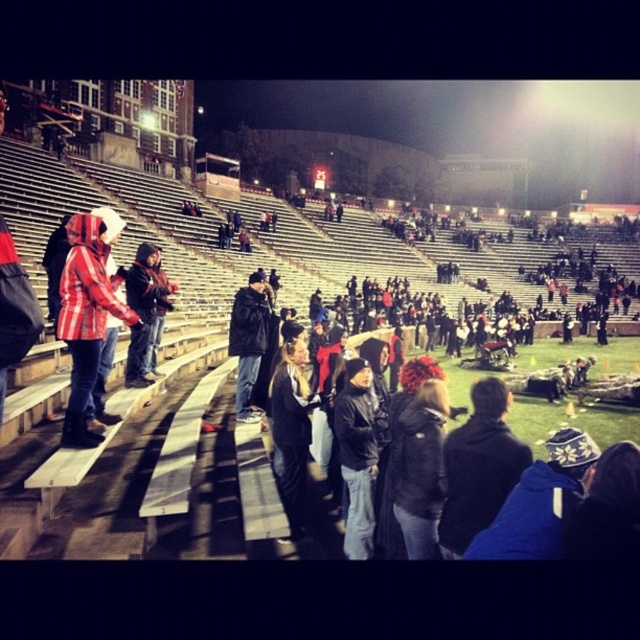
Can you confirm if dark gray leather jacket at center is taller than black leather jacket at center?

In fact, dark gray leather jacket at center may be shorter than black leather jacket at center.

Is point (358, 368) in front of point (259, 316)?

Yes, it is.

Image resolution: width=640 pixels, height=640 pixels. Describe the element at coordinates (356, 456) in the screenshot. I see `dark gray leather jacket at center` at that location.

Find the location of `dark gray leather jacket at center`. dark gray leather jacket at center is located at coordinates (356, 456).

Does dark blue jacket at center have a greater width compared to black leather jacket at center?

Incorrect, dark blue jacket at center's width does not surpass black leather jacket at center's.

Does dark blue jacket at center appear under black leather jacket at center?

Indeed, dark blue jacket at center is positioned under black leather jacket at center.

I want to click on dark blue jacket at center, so click(477, 467).

Does dark gray hoodie at center have a larger size compared to dark red hoodie at center?

No, dark gray hoodie at center is not bigger than dark red hoodie at center.

Who is higher up, dark gray hoodie at center or dark red hoodie at center?

dark red hoodie at center

Between point (406, 472) and point (125, 276), which one is positioned behind?

The point (125, 276) is behind.

This screenshot has height=640, width=640. Identify the location of dark gray hoodie at center. (420, 468).